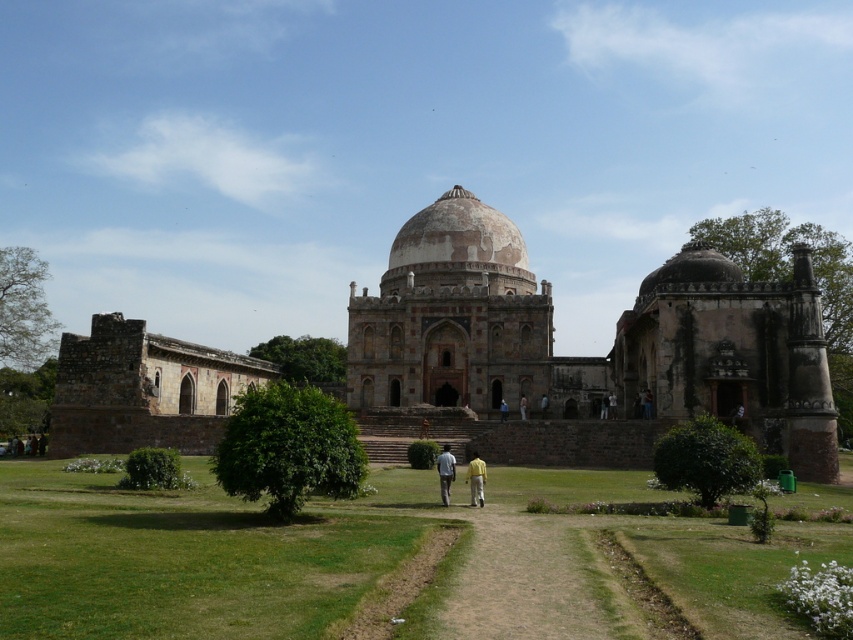
Question: Which point appears farthest from the camera in this image?

Choices:
 (A) (448, 456)
 (B) (155, 372)
 (C) (438, 509)

Answer: (B)

Question: Which of the following is the closest to the observer?

Choices:
 (A) rustic stone palace at center
 (B) dark green fabric couple at lower left
 (C) green grass at center
 (D) brown stone ruins at left

Answer: (C)

Question: Which of the following is the farthest from the observer?

Choices:
 (A) light blue fabric shirt at center
 (B) blue fabric person at center
 (C) green grass at center

Answer: (B)

Question: Considering the relative positions of yellow fabric pants at center and light blue fabric shirt at center in the image provided, where is yellow fabric pants at center located with respect to light blue fabric shirt at center?

Choices:
 (A) left
 (B) right

Answer: (B)

Question: Is green grass at center bigger than dark green fabric couple at lower left?

Choices:
 (A) yes
 (B) no

Answer: (A)

Question: Can you confirm if green grass at center is positioned to the left of yellow fabric pants at center?

Choices:
 (A) no
 (B) yes

Answer: (B)